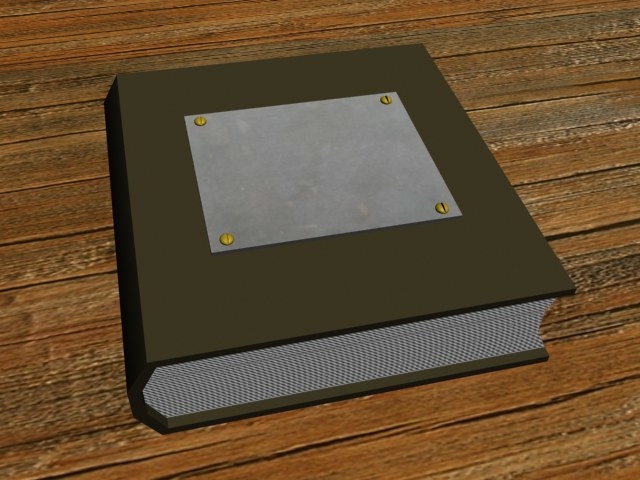
Identify the location of cover. (214, 303).